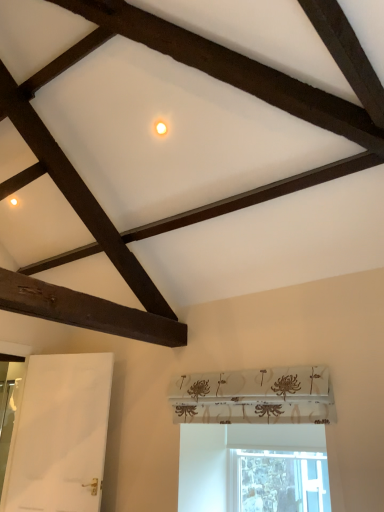
Question: Does transparent glass window at lower center appear on the right side of white matte door at lower left?

Choices:
 (A) yes
 (B) no

Answer: (A)

Question: Can you confirm if transparent glass window at lower center is positioned to the left of white matte door at lower left?

Choices:
 (A) no
 (B) yes

Answer: (A)

Question: Are transparent glass window at lower center and white matte door at lower left beside each other?

Choices:
 (A) yes
 (B) no

Answer: (B)

Question: From a real-world perspective, is transparent glass window at lower center positioned over white matte door at lower left based on gravity?

Choices:
 (A) no
 (B) yes

Answer: (A)

Question: From a real-world perspective, is transparent glass window at lower center physically below white matte door at lower left?

Choices:
 (A) no
 (B) yes

Answer: (B)

Question: Is transparent glass window at lower center oriented away from white matte door at lower left?

Choices:
 (A) no
 (B) yes

Answer: (A)

Question: Is white matte door at lower left shorter than transparent glass window at lower center?

Choices:
 (A) no
 (B) yes

Answer: (A)

Question: Is white matte door at lower left completely or partially outside of transparent glass window at lower center?

Choices:
 (A) no
 (B) yes

Answer: (B)

Question: Is white matte door at lower left at the left side of transparent glass window at lower center?

Choices:
 (A) yes
 (B) no

Answer: (A)

Question: Could you tell me if white matte door at lower left is facing transparent glass window at lower center?

Choices:
 (A) no
 (B) yes

Answer: (A)

Question: Is white matte door at lower left looking in the opposite direction of transparent glass window at lower center?

Choices:
 (A) yes
 (B) no

Answer: (B)

Question: Considering the relative sizes of white matte door at lower left and transparent glass window at lower center in the image provided, is white matte door at lower left taller than transparent glass window at lower center?

Choices:
 (A) no
 (B) yes

Answer: (B)

Question: From the image's perspective, is transparent glass window at lower center positioned above or below white matte door at lower left?

Choices:
 (A) below
 (B) above

Answer: (A)